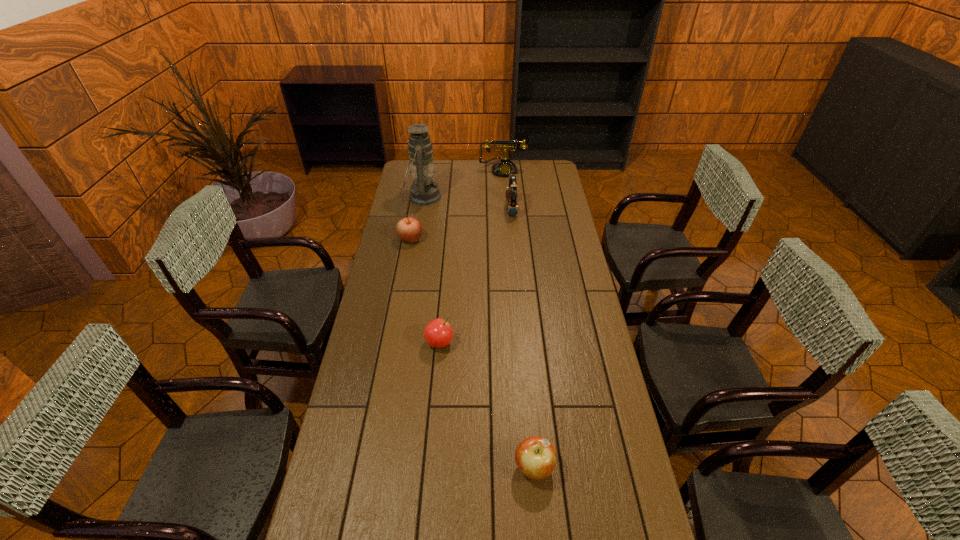
What are the coordinates of `free space at the left edge of the desktop` in the screenshot? It's located at (361, 392).

Image resolution: width=960 pixels, height=540 pixels. Identify the location of vacant space at the right edge of the desktop. (585, 275).

Find the location of a particular element. This screenshot has height=540, width=960. vacant space at the far left corner of the desktop is located at coordinates point(409,168).

I want to click on free space at the far right corner of the desktop, so click(x=557, y=172).

I want to click on empty space between the headset and the tallest object, so click(468, 203).

Locate an element on the screen. The width and height of the screenshot is (960, 540). free space between the headset and the tallest object is located at coordinates (468, 203).

You are a GUI agent. You are given a task and a screenshot of the screen. Output one action in this format:
    pyautogui.click(x=<x>, y=<y>)
    Task: Click on the vacant region between the rightmost apple and the headset
    
    Given the screenshot: What is the action you would take?
    pyautogui.click(x=523, y=338)

Find the location of a particular element. This screenshot has height=540, width=960. free space between the telephone and the second nearest apple is located at coordinates (471, 256).

The height and width of the screenshot is (540, 960). Identify the location of vacant space that's between the leftmost apple and the nearest apple. (472, 353).

The width and height of the screenshot is (960, 540). I want to click on free spot between the fourth farthest object and the farthest object, so click(x=456, y=204).